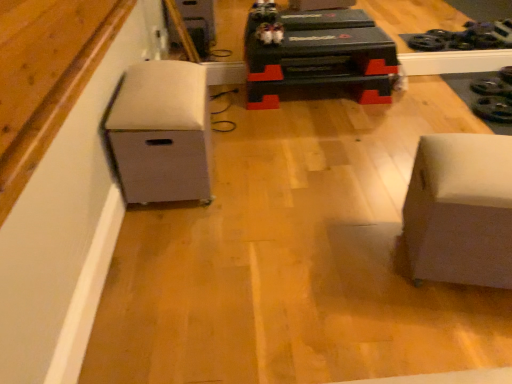
Find the location of a particular element. vacant point above white fabric storage bin at left, which is the second furniture from right to left (from a real-world perspective) is located at coordinates (162, 75).